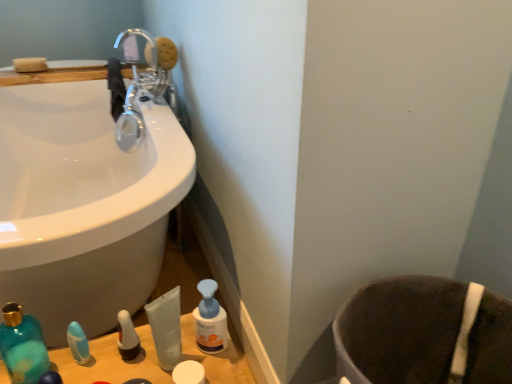
The image size is (512, 384). In order to click on vacant area that lies between white matte container at lower center, the 1th toiletry in the right-to-left sequence, and translucent plastic pump bottle at lower left, positioned as the second toiletry in left-to-right order in this screenshot , I will do `click(159, 361)`.